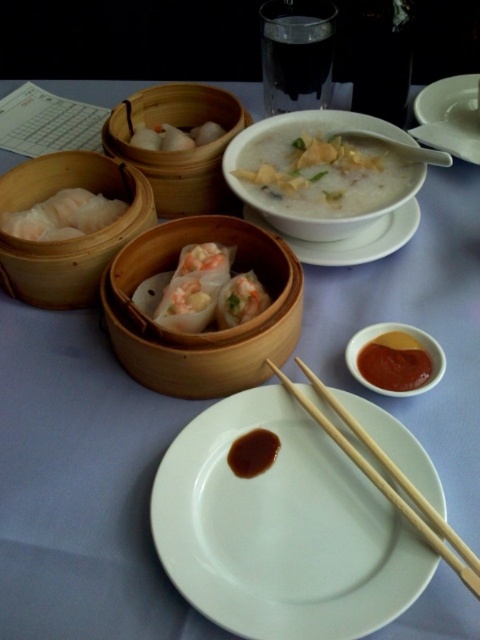
Question: Which of the following is the farthest from the observer?

Choices:
 (A) translucent bamboo steamer at center
 (B) brown glossy sauce at center
 (C) white matte dumplings at upper left

Answer: (C)

Question: Which object is the closest to the white glossy plate at upper right?

Choices:
 (A) white dumpling at left
 (B) white creamy porridge at center
 (C) matte bamboo steamer at upper left

Answer: (B)

Question: Observing the image, what is the correct spatial positioning of white creamy porridge at center in reference to translucent bamboo steamer at center?

Choices:
 (A) right
 (B) left

Answer: (A)

Question: Does white ceramic plate at center have a smaller size compared to matte bamboo steamer at upper left?

Choices:
 (A) yes
 (B) no

Answer: (A)

Question: Based on their relative distances, which object is nearer to the wooden steamer basket at center?

Choices:
 (A) brown glossy sauce at center
 (B) white creamy porridge at center
 (C) white glossy plate at upper right

Answer: (B)

Question: Is matte bamboo steamer at left wider than white ceramic bowl at upper center?

Choices:
 (A) no
 (B) yes

Answer: (A)